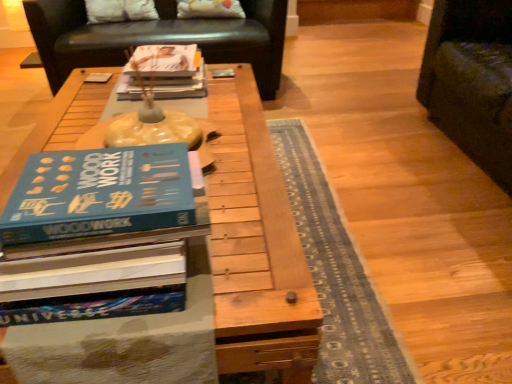
Question: Considering the relative sizes of white fabric pillow at upper center, positioned as the 1th pillow in right-to-left order, and wooden table at center in the image provided, is white fabric pillow at upper center, positioned as the 1th pillow in right-to-left order, shorter than wooden table at center?

Choices:
 (A) yes
 (B) no

Answer: (A)

Question: Does white fabric pillow at upper center, the second pillow viewed from the left, lie in front of wooden table at center?

Choices:
 (A) yes
 (B) no

Answer: (B)

Question: Is white fabric pillow at upper center, positioned as the 1th pillow in right-to-left order, next to wooden table at center and touching it?

Choices:
 (A) no
 (B) yes

Answer: (A)

Question: From the image's perspective, does white fabric pillow at upper center, the second pillow viewed from the left, appear lower than wooden table at center?

Choices:
 (A) no
 (B) yes

Answer: (A)

Question: Is white fabric pillow at upper center, the second pillow viewed from the left, further to the viewer compared to wooden table at center?

Choices:
 (A) no
 (B) yes

Answer: (B)

Question: Would you say white fabric pillow at upper center, positioned as the 1th pillow in right-to-left order, contains wooden table at center?

Choices:
 (A) no
 (B) yes

Answer: (A)

Question: Is matte paper book at center at the left side of black leather couch at upper center?

Choices:
 (A) yes
 (B) no

Answer: (B)

Question: Does matte paper book at center have a lesser height compared to black leather couch at upper center?

Choices:
 (A) no
 (B) yes

Answer: (B)

Question: From a real-world perspective, is matte paper book at center located higher than black leather couch at upper center?

Choices:
 (A) no
 (B) yes

Answer: (B)

Question: Considering the relative sizes of matte paper book at center and black leather couch at upper center in the image provided, is matte paper book at center taller than black leather couch at upper center?

Choices:
 (A) yes
 (B) no

Answer: (B)

Question: Considering the relative positions of matte paper book at center and black leather couch at upper center in the image provided, is matte paper book at center in front of black leather couch at upper center?

Choices:
 (A) no
 (B) yes

Answer: (B)

Question: Considering the relative sizes of matte paper book at center and black leather couch at upper center in the image provided, is matte paper book at center bigger than black leather couch at upper center?

Choices:
 (A) yes
 (B) no

Answer: (B)

Question: From the image's perspective, is white fabric pillow at upper center, which is counted as the first pillow, starting from the left, below wooden table at center?

Choices:
 (A) no
 (B) yes

Answer: (A)